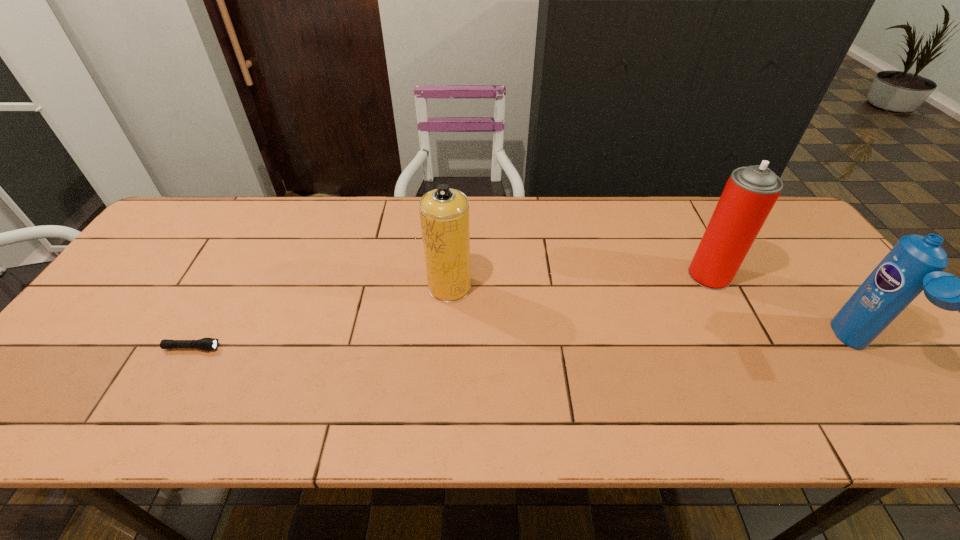
Where is `vacant region between the rightmost object and the left aerosol can`? The height and width of the screenshot is (540, 960). vacant region between the rightmost object and the left aerosol can is located at coordinates (653, 318).

At what (x,y) coordinates should I click in order to perform the action: click on blank region between the right aerosol can and the second object from left to right. Please return your answer as a coordinate pair (x, y). This screenshot has width=960, height=540. Looking at the image, I should click on (580, 281).

This screenshot has width=960, height=540. What are the coordinates of `free space between the left aerosol can and the shampoo` in the screenshot? It's located at (653, 318).

The width and height of the screenshot is (960, 540). I want to click on free area in between the left aerosol can and the rightmost object, so click(653, 318).

At what (x,y) coordinates should I click in order to perform the action: click on free space between the shortest object and the rightmost object. Please return your answer as a coordinate pair (x, y). This screenshot has height=540, width=960. Looking at the image, I should click on pyautogui.click(x=524, y=348).

Identify the location of object that is the second closest to the right aerosol can. The height and width of the screenshot is (540, 960). (444, 212).

This screenshot has height=540, width=960. Identify the location of object that is the second closest to the flashlight. (750, 193).

You are a GUI agent. You are given a task and a screenshot of the screen. Output one action in this format:
    pyautogui.click(x=<x>, y=<y>)
    Task: Click on the free space in the image that satisfies the following two spatial constraints: 1. on the front side of the second object from left to right; 2. on the right side of the shampoo
    The height and width of the screenshot is (540, 960).
    Given the screenshot: What is the action you would take?
    pyautogui.click(x=445, y=347)

Identify the location of free point that satisfies the following two spatial constraints: 1. on the front side of the rightmost object; 2. at the lens end of the leftmost object. (857, 348).